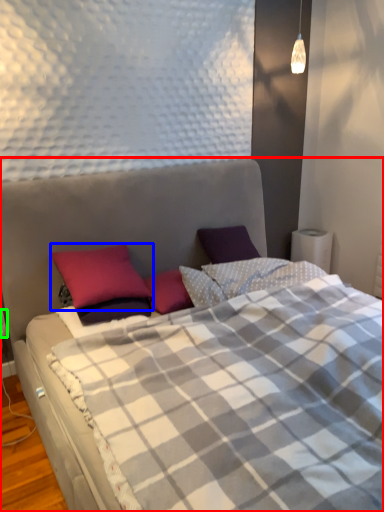
Question: Based on their relative distances, which object is nearer to bed (highlighted by a red box)? Choose from pillow (highlighted by a blue box) and electric outlet (highlighted by a green box).

Choices:
 (A) pillow
 (B) electric outlet

Answer: (A)